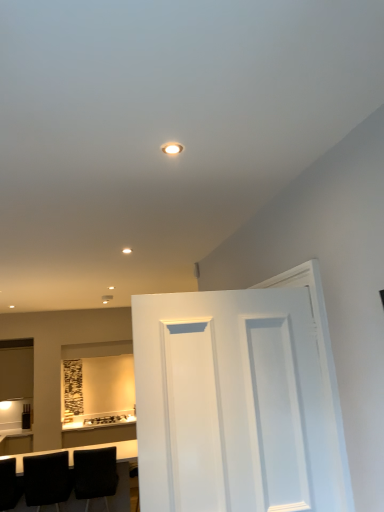
Question: Is black leather table at lower left situated inside matte black toaster at lower center or outside?

Choices:
 (A) inside
 (B) outside

Answer: (B)

Question: In the image, is black leather table at lower left on the left side or the right side of matte black toaster at lower center?

Choices:
 (A) left
 (B) right

Answer: (A)

Question: Considering the real-world distances, which object is farthest from the black leather table at lower left?

Choices:
 (A) white painted wood door at center
 (B) black matte chair at lower left, the first chair when ordered from right to left
 (C) matte black toaster at lower center
 (D) black leather chair at lower left, the first chair in the left-to-right sequence
 (E) black leather chair at lower left, the 2th chair positioned from the left

Answer: (A)

Question: Which of these objects is positioned closest to the black leather table at lower left?

Choices:
 (A) black matte chair at lower left, the first chair when ordered from right to left
 (B) matte black toaster at lower center
 (C) black leather chair at lower left, the 2th chair positioned from the left
 (D) black leather chair at lower left, the first chair in the left-to-right sequence
 (E) white painted wood door at center

Answer: (A)